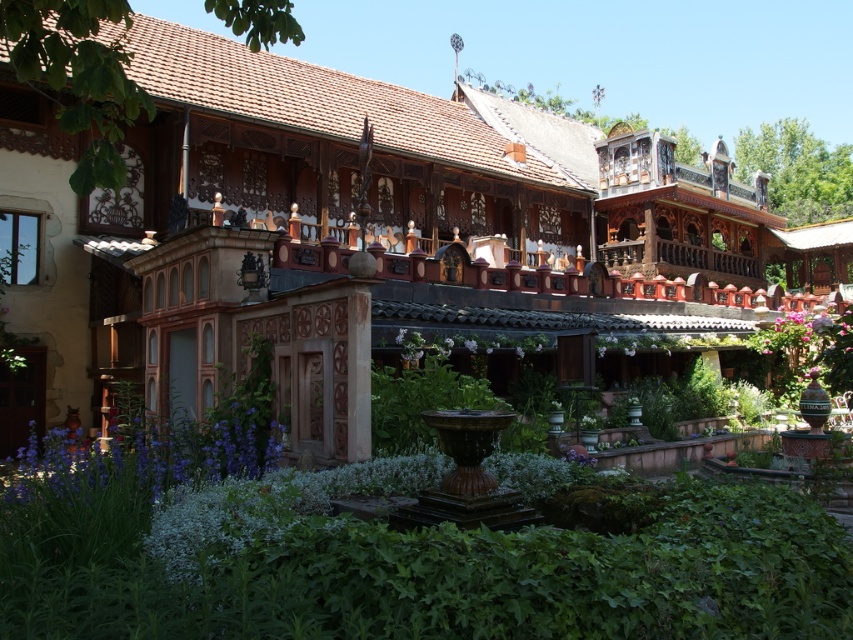
You are a visitor standing in front of the ornate building. You notice the wooden balcony at center and the purple matte flower at center. Which object is taller?

The wooden balcony at center is much taller than the purple matte flower at center.

You are standing in front of the ornate building and notice a wooden balcony at center and a purple matte flower at center. Which object is positioned to the right of the other?

The wooden balcony at center is to the right of purple matte flower at center.

Based on the photo, you are standing in front of the ornate building and want to determine the relative positions of two points marked on the facade. Which point is closer to you, the point at coordinate [195,84] or the point at [518,353]?

The point at coordinate [195,84] is closer to you because it is further to the viewer than the point at [518,353].